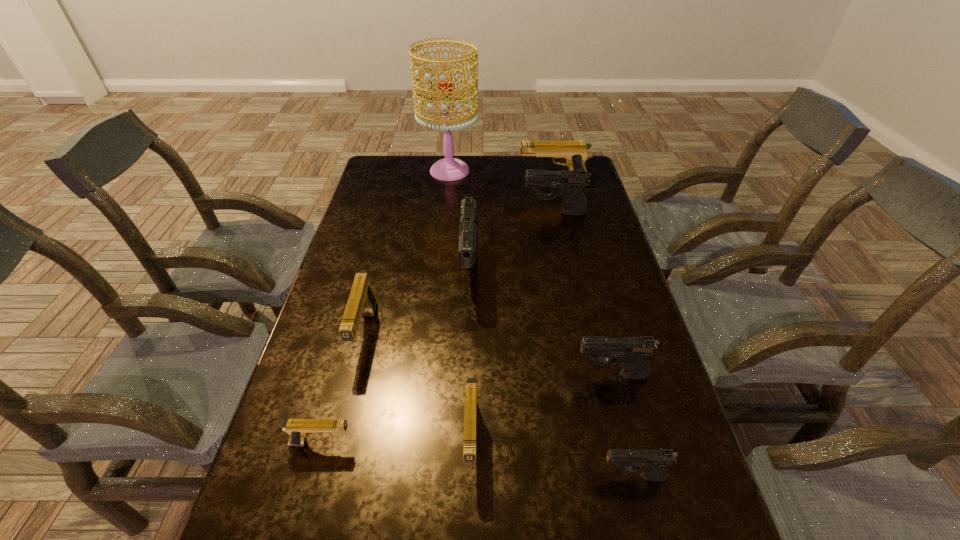
The image size is (960, 540). In order to click on lampshade in this screenshot , I will do `click(448, 169)`.

This screenshot has width=960, height=540. In order to click on the leftmost black pistol in this screenshot , I will do `click(468, 236)`.

Locate an element on the screen. This screenshot has height=540, width=960. the tallest pistol is located at coordinates (468, 236).

Find the location of a particular element. The width and height of the screenshot is (960, 540). the farthest tan pistol is located at coordinates (574, 154).

Find the location of a particular element. the farthest pistol is located at coordinates (574, 154).

Identify the location of the farthest black pistol. This screenshot has width=960, height=540. (569, 184).

You are a GUI agent. You are given a task and a screenshot of the screen. Output one action in this format:
    pyautogui.click(x=<x>, y=<y>)
    Task: Click on the seventh nearest object
    
    Given the screenshot: What is the action you would take?
    pyautogui.click(x=569, y=184)

Where is `the third smallest tan pistol`? This screenshot has width=960, height=540. the third smallest tan pistol is located at coordinates (361, 300).

This screenshot has height=540, width=960. I want to click on the third farthest black pistol, so click(632, 353).

Where is `the second smallest tan pistol`? This screenshot has height=540, width=960. the second smallest tan pistol is located at coordinates (470, 412).